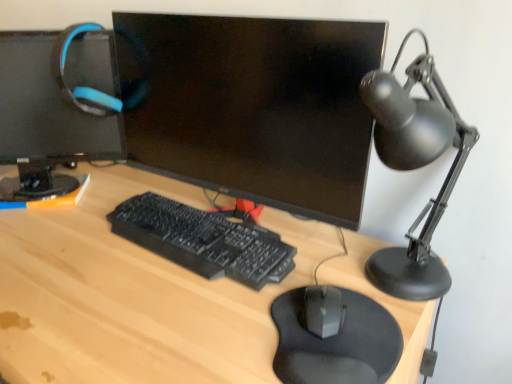
You are a GUI agent. You are given a task and a screenshot of the screen. Output one action in this format:
    pyautogui.click(x=<x>, y=<y>)
    Task: Click on the free location in front of black plastic keyboard at center
    This screenshot has width=512, height=384.
    Given the screenshot: What is the action you would take?
    pyautogui.click(x=161, y=309)